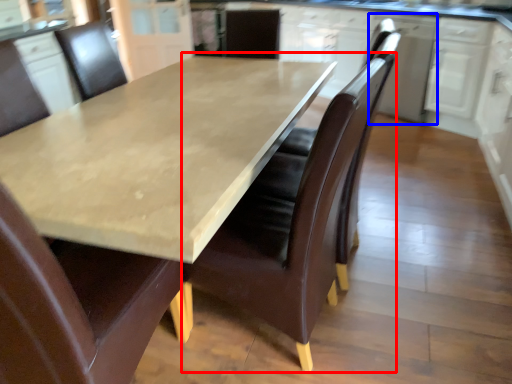
Question: Among these objects, which one is nearest to the camera, chair (highlighted by a red box) or cabinetry (highlighted by a blue box)?

Choices:
 (A) chair
 (B) cabinetry

Answer: (A)